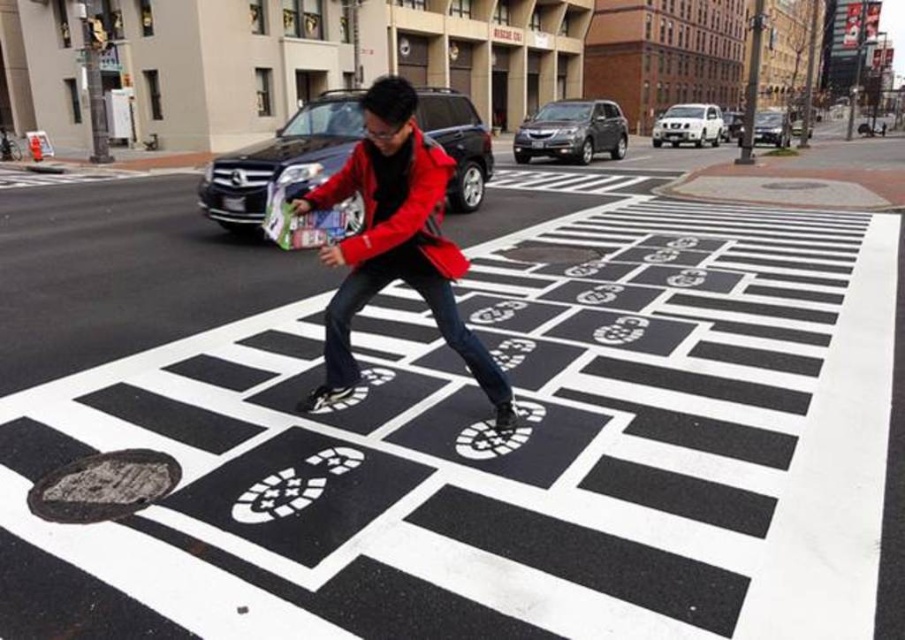
You are a pedestrian standing on the crosswalk in the image. You see two objects labeled as red matte jacket at center and matte red jacket at center. Which one is closer to you?

Both objects are the same, as the red matte jacket at center and matte red jacket at center refer to the same item. The description indicates they are positioned at the same location, so there is no difference in their distance from you.

From the picture: You are a pedestrian standing at the edge of the crosswalk. You see the black asphalt at center and the matte red jacket at center. Which object is closer to you?

The black asphalt at center is closer to the viewer than the matte red jacket at center.